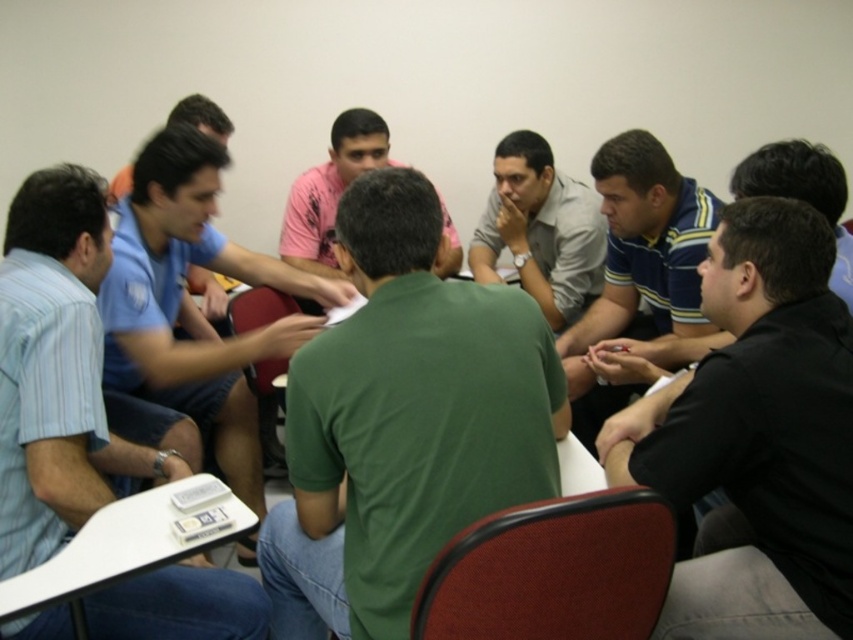
You are standing in the room and want to find the black matte shirt at lower right. According to the coordinates provided, where should you look to locate it?

The black matte shirt at lower right is located at the coordinates point (762, 435).

Based on the photo, you are a photographer standing behind the group at the table. You want to take a photo that includes both the green matte shirt at center and the blue shirt at center. Given that your camera has a maximum focus range of 30 inches, will you be able to capture both subjects clearly in focus?

The green matte shirt at center is 31.40 inches from the blue shirt at center. Since the distance between them exceeds the camera focus range of 30 inches, you may not be able to capture both clearly in focus.

You are an observer looking at the group around the table. You notice two shirts in the scene, the black matte shirt at lower right and the blue striped shirt at center. Which of these two shirts appears to be smaller in size?

The black matte shirt at lower right has a smaller size compared to the blue striped shirt at center.